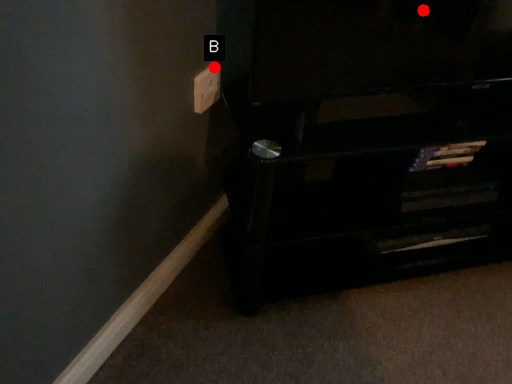
Question: Two points are circled on the image, labeled by A and B beside each circle. Which of the following is the farthest from the observer?

Choices:
 (A) A is further
 (B) B is further

Answer: (B)